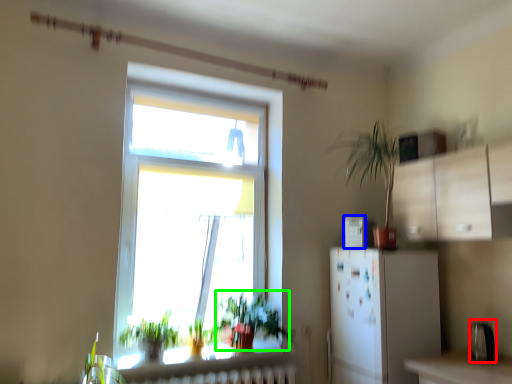
Question: Which object is positioned closest to appliance (highlighted by a red box)? Select from appliance (highlighted by a blue box) and vegetation (highlighted by a green box).

Choices:
 (A) appliance
 (B) vegetation

Answer: (A)